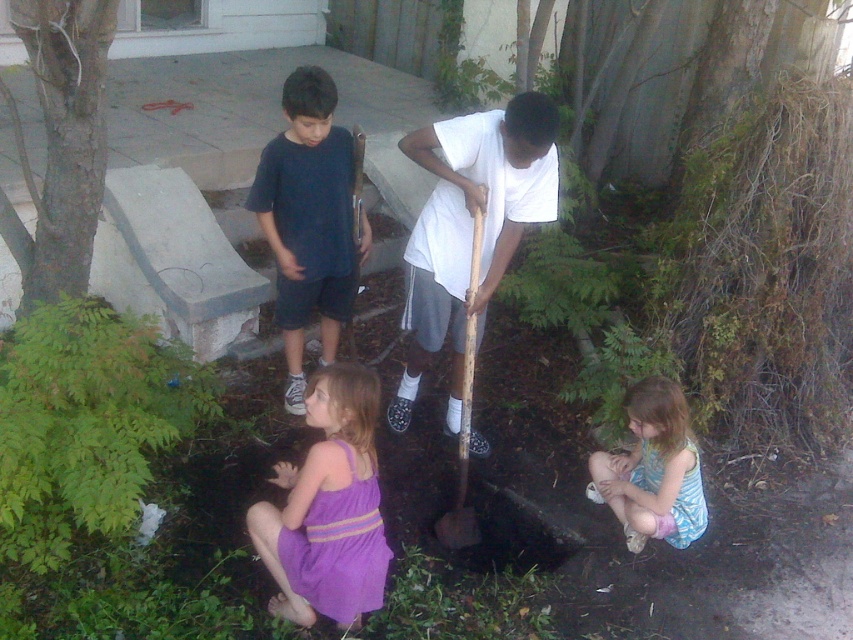
Based on the photo, you are a parent trying to decide which item to give to your child first. The white wood shovel at center and the light blue striped dress at lower right are both within reach. Based on their sizes, which item should you pick up first to ensure it fits in your 18 inch wide bag?

The white wood shovel at center is larger in size than the light blue striped dress at lower right. Therefore, you should pick up the light blue striped dress at lower right first to ensure it fits in your 18 inch wide bag since it is smaller.